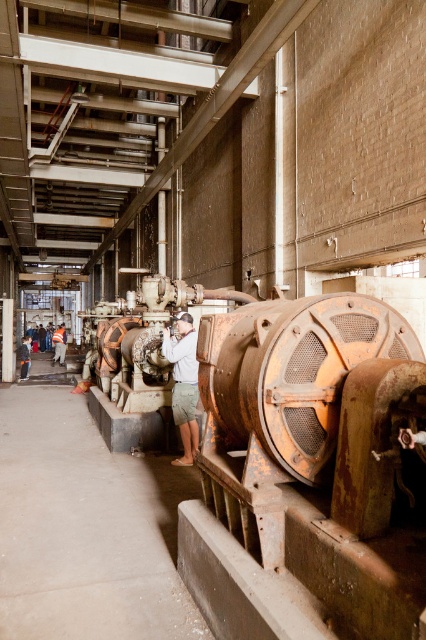
Question: Is light brown fabric shorts at center smaller than orange reflective vest at center?

Choices:
 (A) yes
 (B) no

Answer: (A)

Question: Which of the following is the closest to the observer?

Choices:
 (A) (58, 355)
 (B) (23, 339)

Answer: (A)

Question: Does light brown fabric shorts at center have a larger size compared to light brown leather jacket at lower left?

Choices:
 (A) yes
 (B) no

Answer: (B)

Question: Which of the following is the closest to the observer?

Choices:
 (A) (26, 376)
 (B) (189, 397)
 (C) (63, 358)

Answer: (B)

Question: Can you confirm if orange reflective vest at center is positioned to the right of light brown leather jacket at lower left?

Choices:
 (A) yes
 (B) no

Answer: (B)

Question: Which object is the farthest from the light brown leather jacket at lower left?

Choices:
 (A) light brown fabric shorts at center
 (B) orange reflective vest at center

Answer: (A)